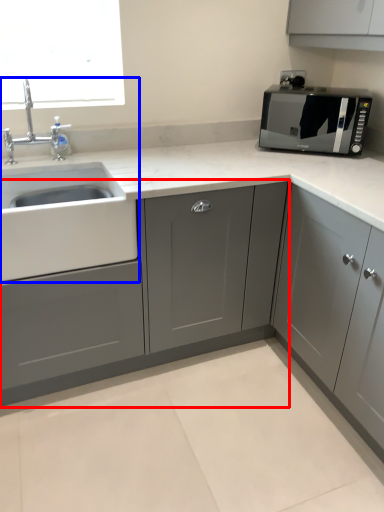
Question: Which object appears farthest to the camera in this image, cabinetry (highlighted by a red box) or sink (highlighted by a blue box)?

Choices:
 (A) cabinetry
 (B) sink

Answer: (B)